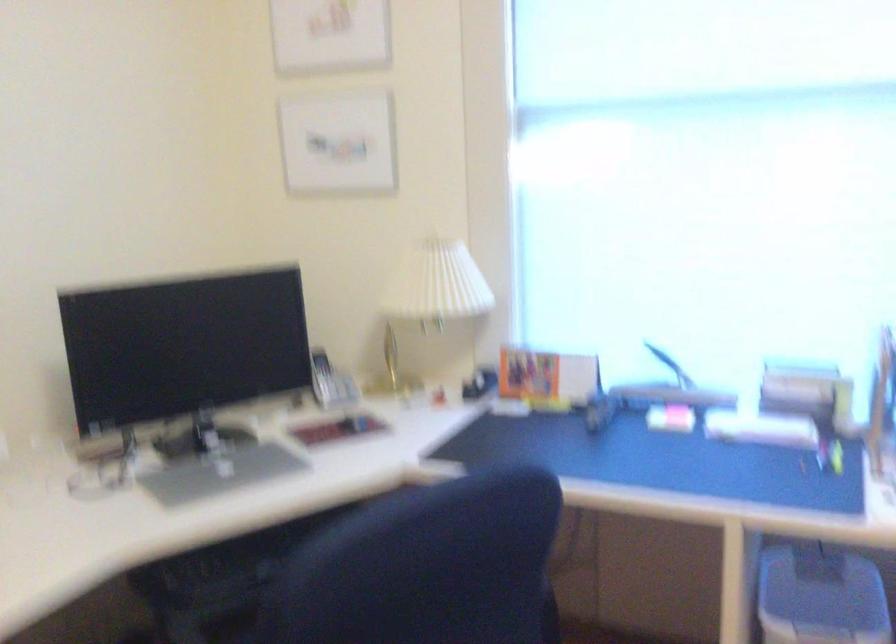
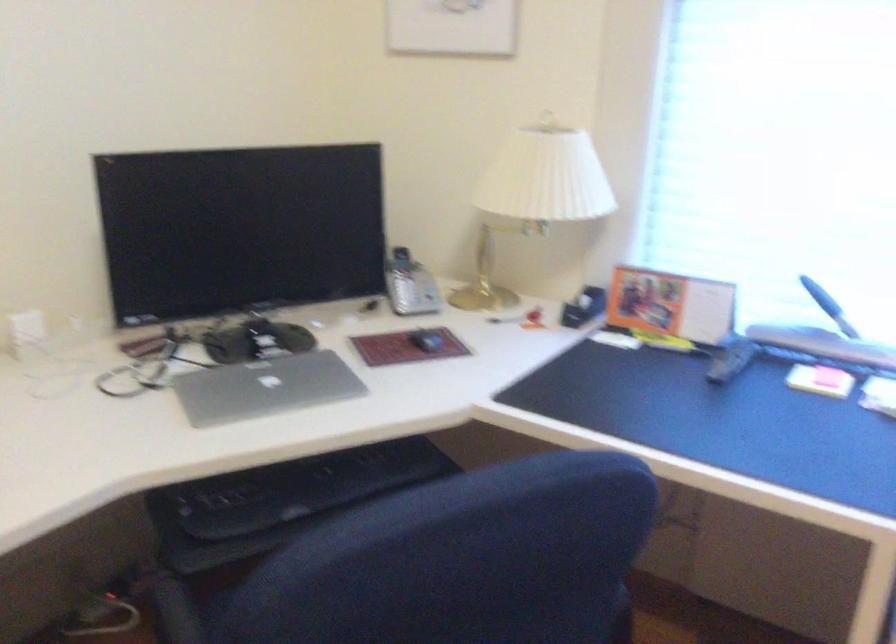
The point at (552, 375) is marked in the first image. Where is the corresponding point in the second image?

(670, 305)